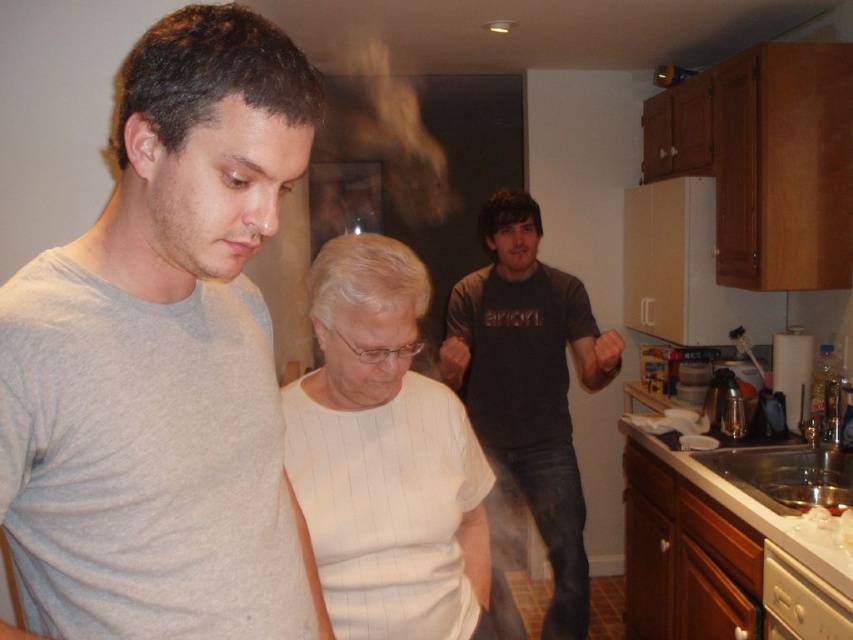
Is white striped shirt at center positioned behind dark gray t-shirt at center?

No, it is in front of dark gray t-shirt at center.

Measure the distance between white striped shirt at center and dark gray t-shirt at center.

white striped shirt at center is 92.87 centimeters away from dark gray t-shirt at center.

Is point (396, 522) positioned before point (573, 301)?

Yes, it is in front of point (573, 301).

Image resolution: width=853 pixels, height=640 pixels. In order to click on white striped shirt at center in this screenshot , I will do [x=386, y=456].

Which is more to the left, gray cotton t-shirt at upper left or white striped shirt at center?

From the viewer's perspective, gray cotton t-shirt at upper left appears more on the left side.

Describe the element at coordinates (173, 337) in the screenshot. The width and height of the screenshot is (853, 640). I see `gray cotton t-shirt at upper left` at that location.

Does point (180, 97) lie in front of point (469, 532)?

Yes, point (180, 97) is closer to viewer.

The width and height of the screenshot is (853, 640). In order to click on gray cotton t-shirt at upper left in this screenshot , I will do `click(173, 337)`.

Does gray cotton t-shirt at upper left come in front of dark gray t-shirt at center?

That is True.

Who is taller, gray cotton t-shirt at upper left or dark gray t-shirt at center?

With more height is dark gray t-shirt at center.

Which is behind, point (193, 628) or point (583, 289)?

Positioned behind is point (583, 289).

The image size is (853, 640). I want to click on gray cotton t-shirt at upper left, so click(173, 337).